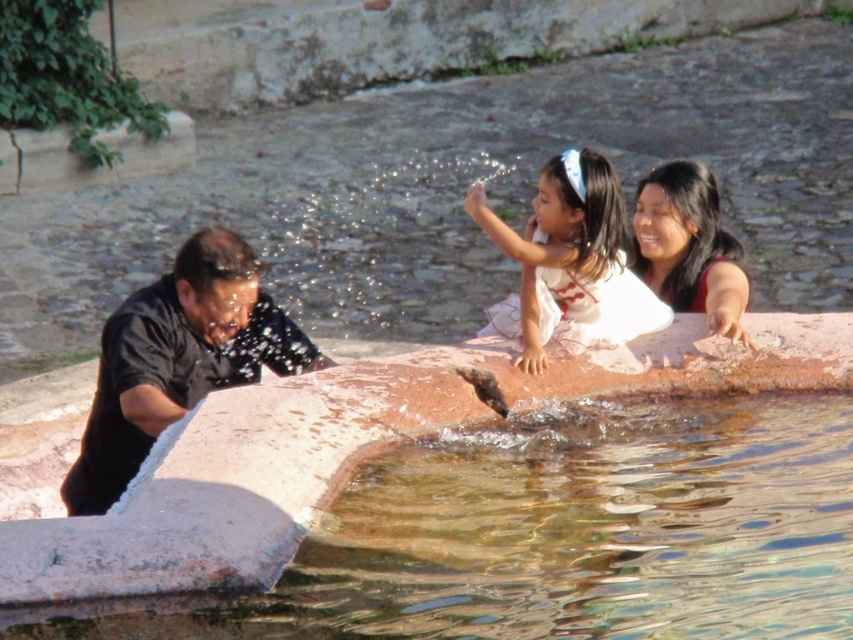
Can you confirm if clear water at fountain left is bigger than white satin dress at center?

Actually, clear water at fountain left might be smaller than white satin dress at center.

Can you confirm if clear water at fountain left is taller than white satin dress at center?

Incorrect, clear water at fountain left's height is not larger of white satin dress at center's.

Between point (648, 596) and point (630, 292), which one is positioned behind?

The point (630, 292) is more distant.

At what (x,y) coordinates should I click in order to perform the action: click on clear water at fountain left. Please return your answer as a coordinate pair (x, y). Looking at the image, I should click on (570, 532).

Can you confirm if white satin dress at center is shorter than smooth red dress at upper right?

No.

Which is behind, point (589, 324) or point (631, 256)?

The point (631, 256) is more distant.

The height and width of the screenshot is (640, 853). What do you see at coordinates (569, 264) in the screenshot?
I see `white satin dress at center` at bounding box center [569, 264].

This screenshot has height=640, width=853. Identify the location of white satin dress at center. (569, 264).

Does black matte shirt at left have a greater height compared to white satin dress at center?

No, black matte shirt at left is not taller than white satin dress at center.

Does black matte shirt at left have a smaller size compared to white satin dress at center?

Indeed, black matte shirt at left has a smaller size compared to white satin dress at center.

Does point (151, 362) come farther from viewer compared to point (561, 166)?

Yes, it is.

You are a GUI agent. You are given a task and a screenshot of the screen. Output one action in this format:
    pyautogui.click(x=<x>, y=<y>)
    Task: Click on the black matte shirt at left
    
    Given the screenshot: What is the action you would take?
    pyautogui.click(x=178, y=358)